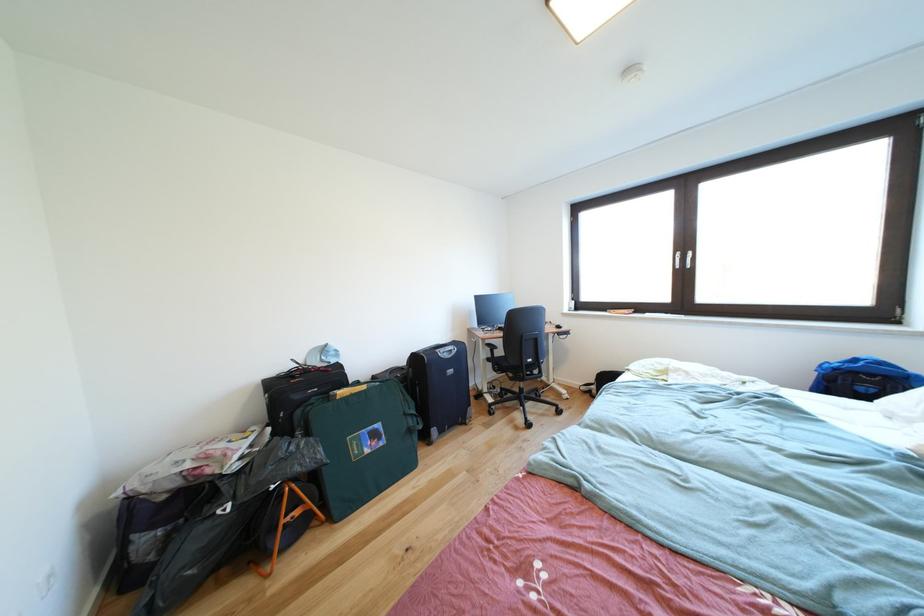
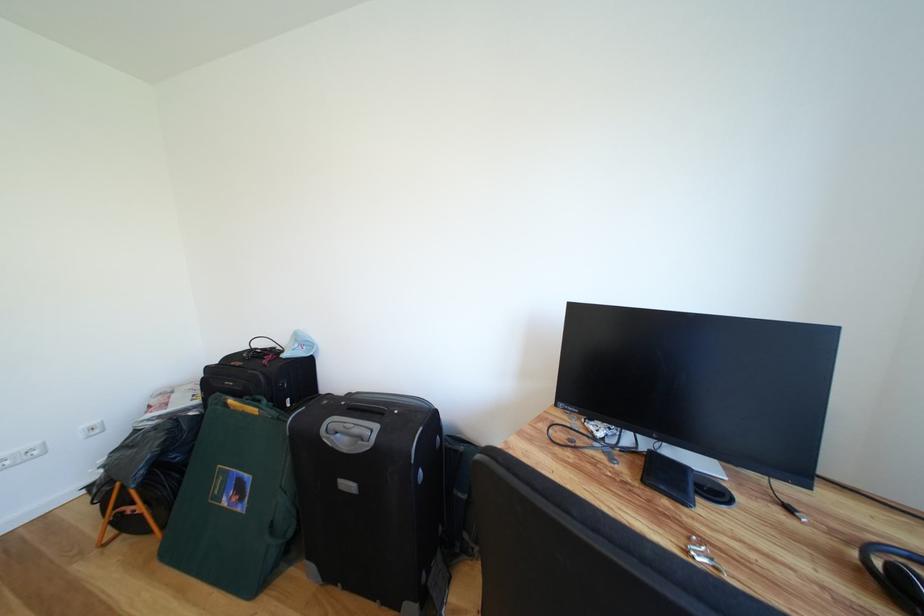
Find the pixel in the second image that matches the point at 375,456 in the first image.

(234, 506)